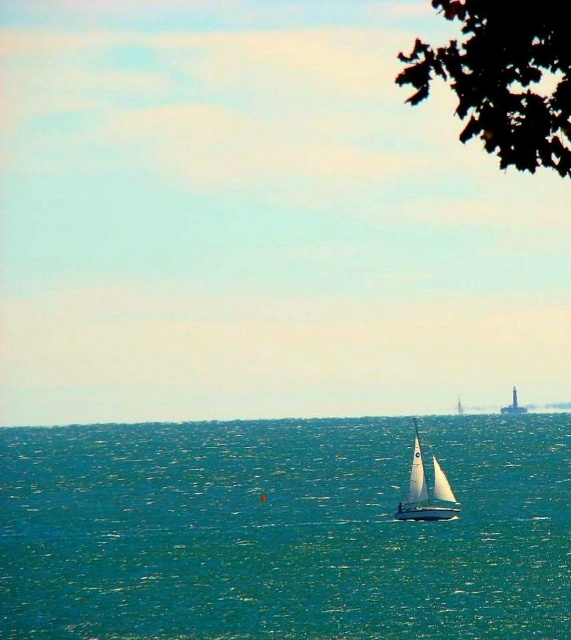
You are a bird flying over the sea and want to land on the closest object. Which object should you choose between the green leafy tree at upper right and the white sailboat at center?

The green leafy tree at upper right is to the right of the white sailboat at center, so the white sailboat at center is closer to your current position over the sea.

You are a drone operator trying to capture a photo of the green leafy tree at upper right. The drone is currently at the center of the image. Which direction should you move the drone to get closer to the tree?

The green leafy tree at upper right is located at point 0.122 on the x axis and 0.883 on the y axis. Since the center of the image is at point 0.5 on both axes, you should move the drone to the left and upwards to reach the tree.

You are standing on the deck of the white sailboat at center and want to look towards the direction of the teal water at center. Which direction should you face?

The teal water at center is to the left of the white sailboat at center, so you should face to the left to look towards the teal water at center.